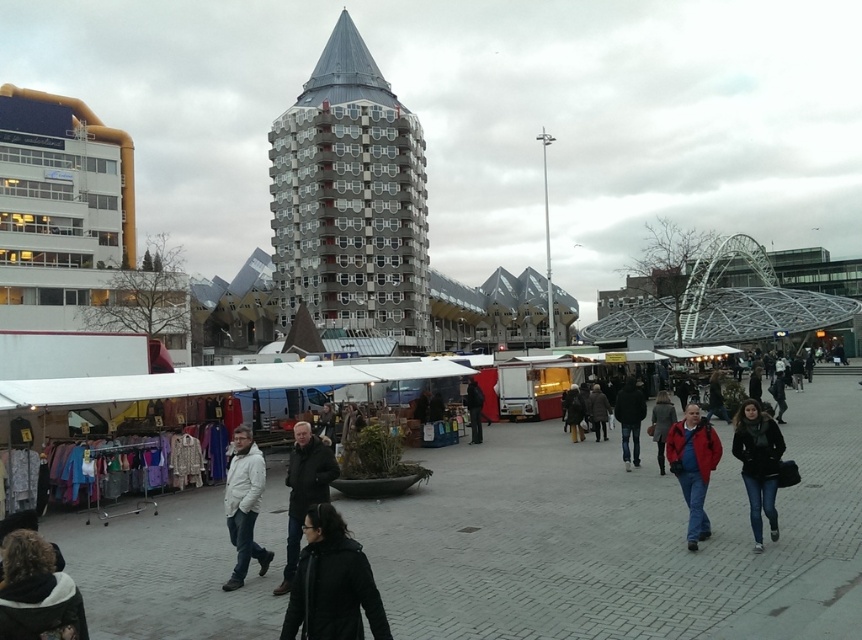
Which is more to the right, dark brown leather jacket at center or jeans at center?

From the viewer's perspective, jeans at center appears more on the right side.

Who is more distant from viewer, (x=309, y=605) or (x=773, y=454)?

Point (x=773, y=454)

Does point (361, 561) come farther from viewer compared to point (753, 509)?

No, (361, 561) is closer to viewer.

Locate an element on the screen. This screenshot has width=862, height=640. dark brown leather jacket at center is located at coordinates (332, 582).

What do you see at coordinates (332, 582) in the screenshot?
I see `dark brown leather jacket at center` at bounding box center [332, 582].

Is point (301, 621) closer to viewer compared to point (623, 388)?

Yes, point (301, 621) is in front of point (623, 388).

Between point (298, 604) and point (623, 419), which one is positioned in front?

Point (298, 604) is more forward.

Locate an element on the screen. This screenshot has height=640, width=862. dark brown leather jacket at center is located at coordinates (332, 582).

What do you see at coordinates (244, 506) in the screenshot?
I see `white matte jacket at center` at bounding box center [244, 506].

Is white matte jacket at center positioned in front of black leather jacket at center?

That is True.

Find the location of `white matte jacket at center`. white matte jacket at center is located at coordinates (244, 506).

The width and height of the screenshot is (862, 640). In order to click on white matte jacket at center in this screenshot , I will do `click(244, 506)`.